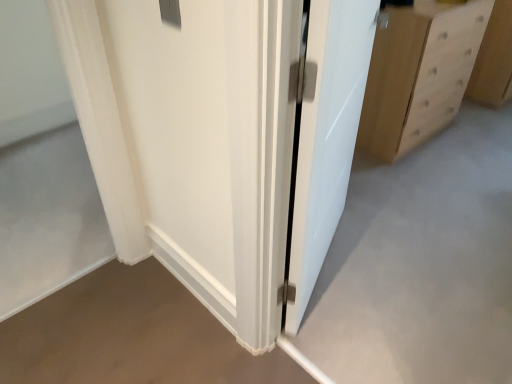
Question: Can you confirm if light wood drawer at right is shorter than white sheer curtain at left?

Choices:
 (A) no
 (B) yes

Answer: (B)

Question: Can you confirm if light wood drawer at right is taller than white sheer curtain at left?

Choices:
 (A) no
 (B) yes

Answer: (A)

Question: Is light wood drawer at right closer to the viewer compared to white sheer curtain at left?

Choices:
 (A) yes
 (B) no

Answer: (B)

Question: Is light wood drawer at right facing towards white sheer curtain at left?

Choices:
 (A) yes
 (B) no

Answer: (B)

Question: From the image's perspective, is light wood drawer at right on white sheer curtain at left?

Choices:
 (A) no
 (B) yes

Answer: (B)

Question: From a real-world perspective, does light wood drawer at right stand above white sheer curtain at left?

Choices:
 (A) no
 (B) yes

Answer: (A)

Question: From the image's perspective, is white glossy door at center beneath light brown wood chest of drawers at right?

Choices:
 (A) yes
 (B) no

Answer: (A)

Question: Is white glossy door at center touching light brown wood chest of drawers at right?

Choices:
 (A) yes
 (B) no

Answer: (B)

Question: Considering the relative sizes of white glossy door at center and light brown wood chest of drawers at right in the image provided, is white glossy door at center thinner than light brown wood chest of drawers at right?

Choices:
 (A) yes
 (B) no

Answer: (A)

Question: Does white glossy door at center appear on the left side of light brown wood chest of drawers at right?

Choices:
 (A) no
 (B) yes

Answer: (B)

Question: From the image's perspective, is white glossy door at center located above light brown wood chest of drawers at right?

Choices:
 (A) no
 (B) yes

Answer: (A)

Question: Is white glossy door at center wider than light brown wood chest of drawers at right?

Choices:
 (A) yes
 (B) no

Answer: (B)

Question: Is white sheer curtain at left looking in the opposite direction of white glossy door at center?

Choices:
 (A) no
 (B) yes

Answer: (A)